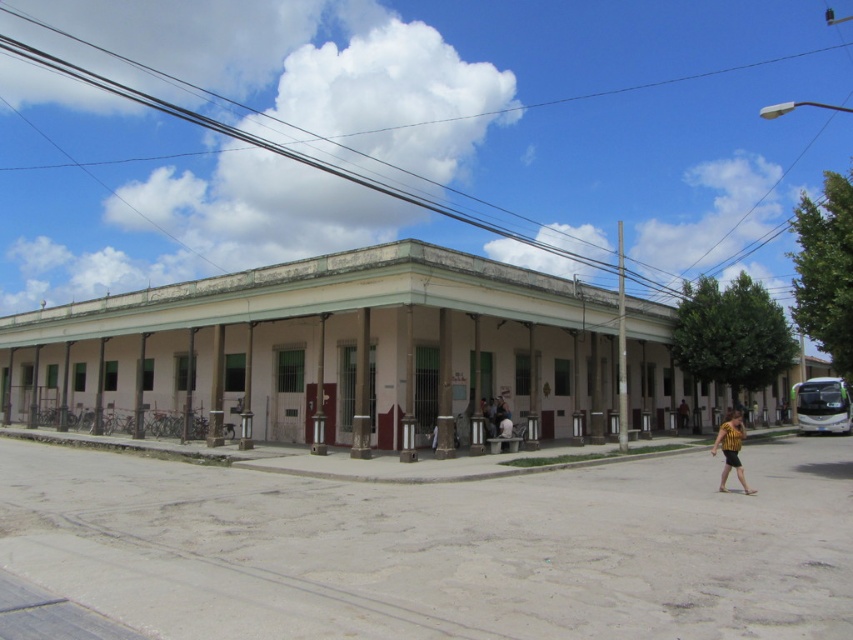
Question: Can you confirm if yellow striped shirt at lower right is positioned to the left of brown leather jacket at lower right?

Choices:
 (A) yes
 (B) no

Answer: (A)

Question: Among these objects, which one is farthest from the camera?

Choices:
 (A) brown leather jacket at lower right
 (B) yellow striped shirt at lower right

Answer: (A)

Question: Among these objects, which one is nearest to the camera?

Choices:
 (A) brown leather jacket at lower right
 (B) yellow striped shirt at lower right

Answer: (B)

Question: Does yellow striped shirt at lower right appear on the right side of brown leather jacket at lower right?

Choices:
 (A) no
 (B) yes

Answer: (A)

Question: Which point is closer to the camera?

Choices:
 (A) (677, 410)
 (B) (735, 451)

Answer: (B)

Question: Can you confirm if yellow striped shirt at lower right is wider than brown leather jacket at lower right?

Choices:
 (A) yes
 (B) no

Answer: (A)